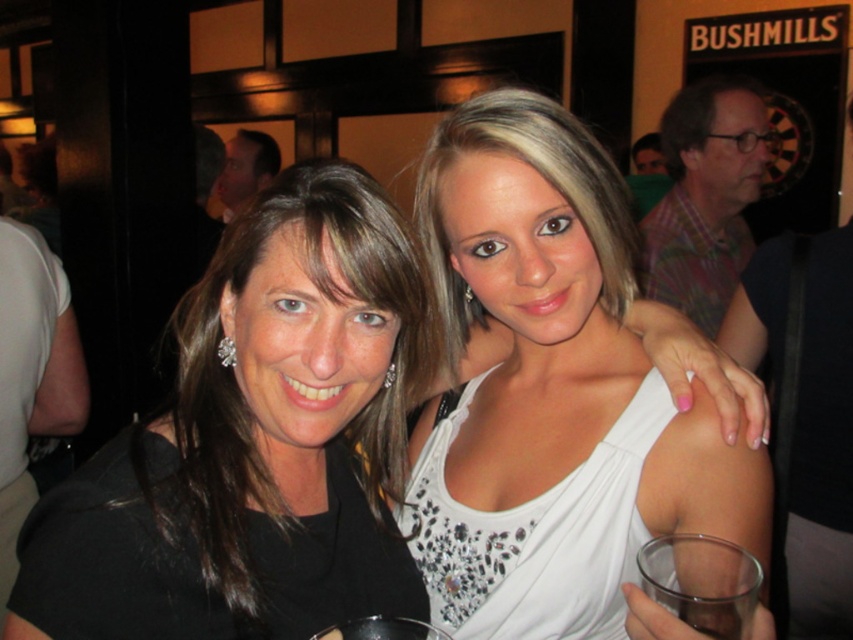
Question: Can you confirm if white satin dress at center is positioned above transparent plastic wine glass at lower center?

Choices:
 (A) no
 (B) yes

Answer: (B)

Question: Which point is closer to the camera taking this photo?

Choices:
 (A) (405, 365)
 (B) (337, 625)

Answer: (B)

Question: Which object appears farthest from the camera in this image?

Choices:
 (A) plaid shirt at upper right
 (B) transparent plastic wine glass at lower center
 (C) white satin dress at center
 (D) transparent glass at lower right

Answer: (A)

Question: Based on their relative distances, which object is nearer to the matte black dress at center?

Choices:
 (A) white satin dress at center
 (B) plaid shirt at upper right
 (C) transparent glass at lower right
 (D) transparent plastic wine glass at lower center

Answer: (A)

Question: Is plaid shirt at upper right below transparent plastic wine glass at lower center?

Choices:
 (A) yes
 (B) no

Answer: (B)

Question: Is white satin dress at center further to the viewer compared to plaid shirt at upper right?

Choices:
 (A) no
 (B) yes

Answer: (A)